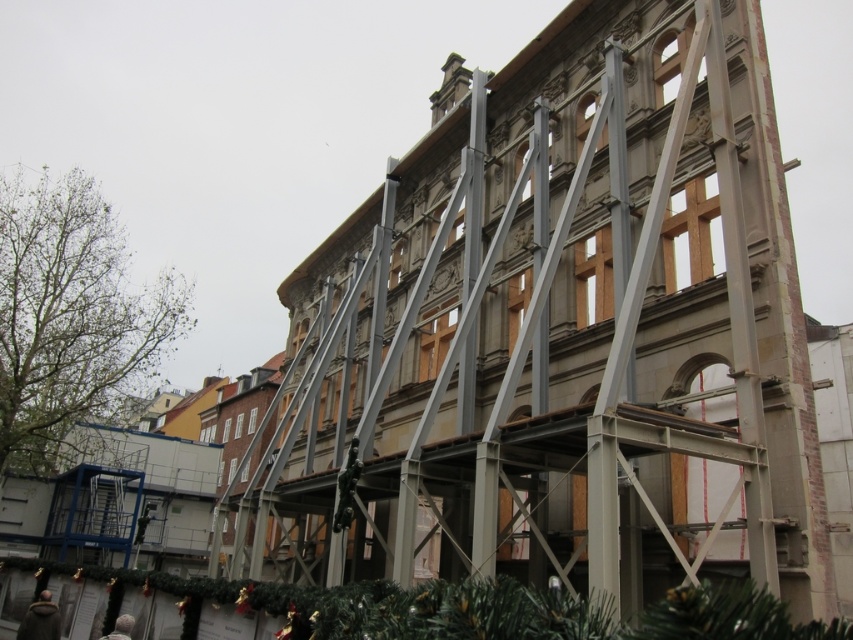
Question: Can you confirm if dark gray coat at lower center is positioned below dark gray fabric at lower left?

Choices:
 (A) no
 (B) yes

Answer: (B)

Question: Which of the following is the farthest from the observer?

Choices:
 (A) dark gray fabric at lower left
 (B) dark gray coat at lower center

Answer: (B)

Question: Can you confirm if dark gray coat at lower center is positioned below dark gray fabric at lower left?

Choices:
 (A) yes
 (B) no

Answer: (A)

Question: Which point is closer to the camera taking this photo?

Choices:
 (A) (131, 621)
 (B) (55, 616)

Answer: (A)

Question: Which point is farther to the camera?

Choices:
 (A) (48, 625)
 (B) (126, 614)

Answer: (B)

Question: Is dark gray coat at lower center to the left of dark gray fabric at lower left from the viewer's perspective?

Choices:
 (A) yes
 (B) no

Answer: (A)